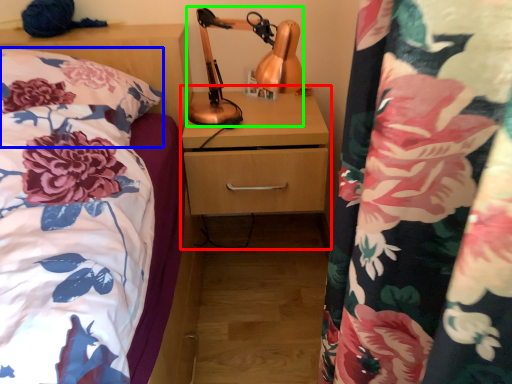
Question: Which object is positioned farthest from dresser (highlighted by a red box)? Select from pillow (highlighted by a blue box) and table lamp (highlighted by a green box).

Choices:
 (A) pillow
 (B) table lamp

Answer: (A)